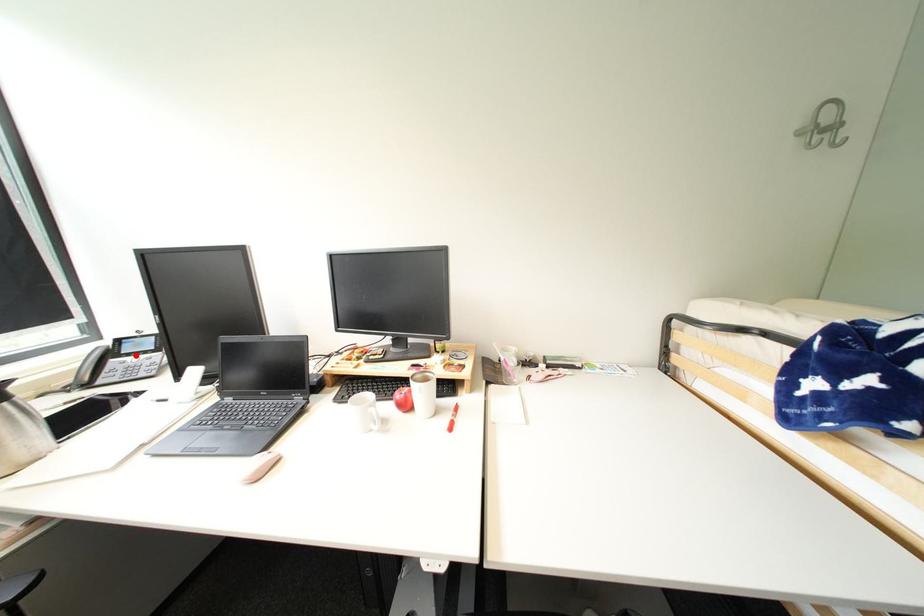
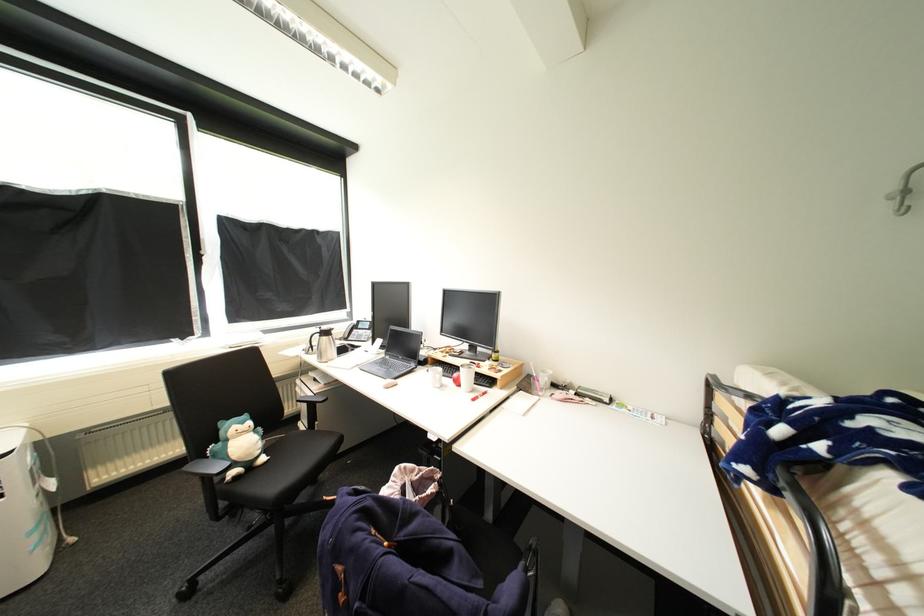
The point at the highlighted location is marked in the first image. Where is the corresponding point in the second image?

(367, 330)